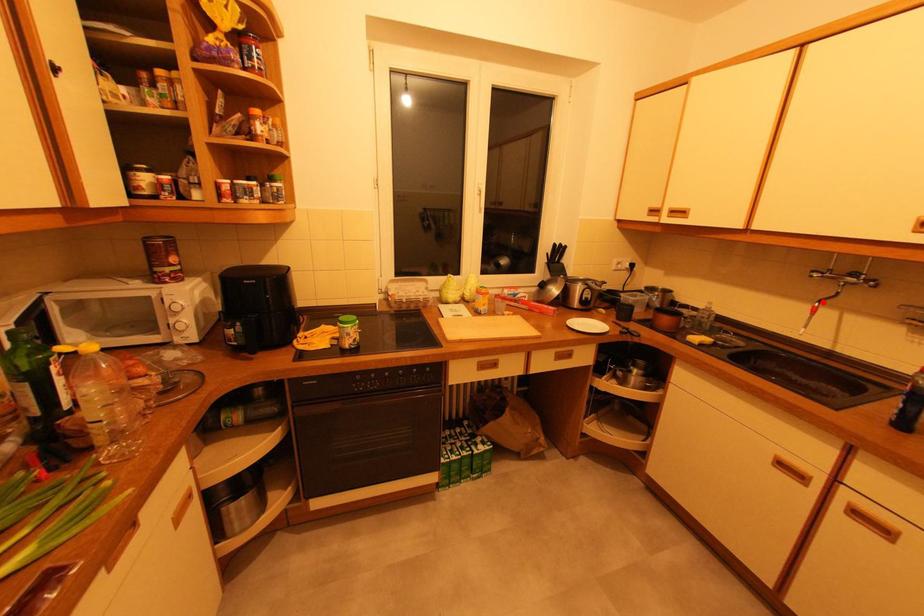
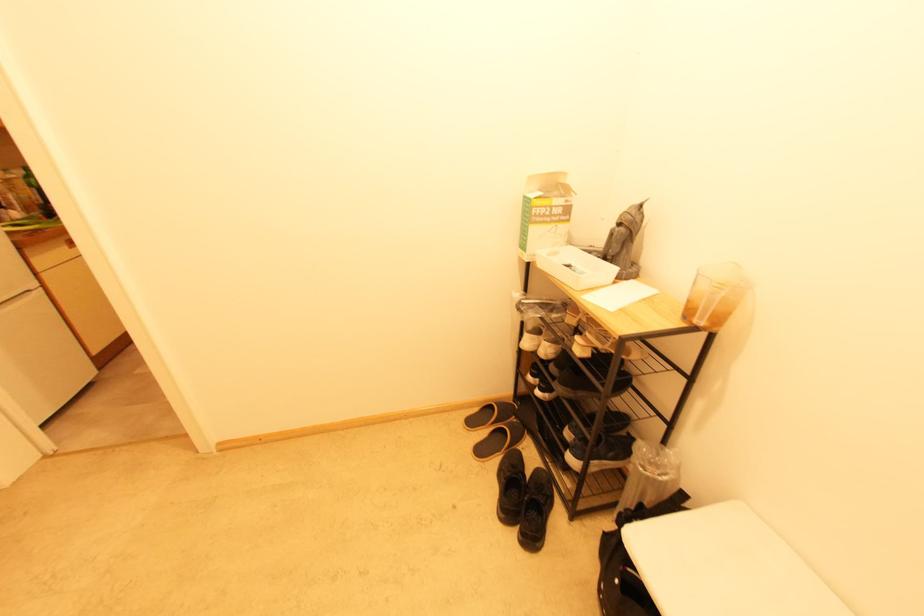
Question: I am providing you with two images of the same scene from different viewpoints. A red point is marked on the first image. Can you still see the location of the red point in image 2?

Choices:
 (A) Yes
 (B) No

Answer: (B)